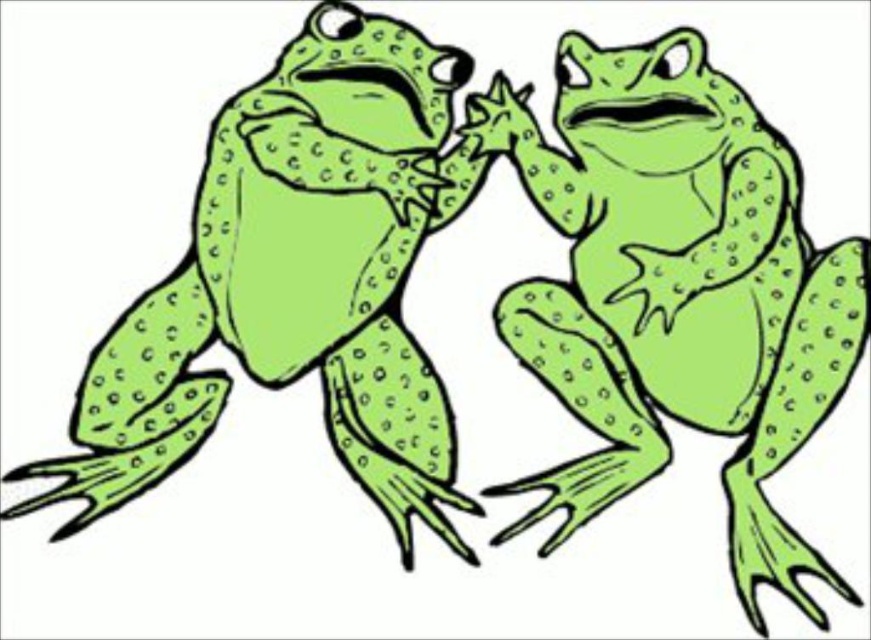
Question: Does green matte/skinny frog at right come in front of green dotted frog at left?

Choices:
 (A) yes
 (B) no

Answer: (B)

Question: Among these objects, which one is nearest to the camera?

Choices:
 (A) green matte/skinny frog at right
 (B) green dotted frog at left

Answer: (B)

Question: Observing the image, what is the correct spatial positioning of green matte/skinny frog at right in reference to green dotted frog at left?

Choices:
 (A) below
 (B) above

Answer: (A)

Question: Can you confirm if green matte/skinny frog at right is positioned below green dotted frog at left?

Choices:
 (A) no
 (B) yes

Answer: (B)

Question: Which of the following is the closest to the observer?

Choices:
 (A) (69, 529)
 (B) (836, 374)

Answer: (A)